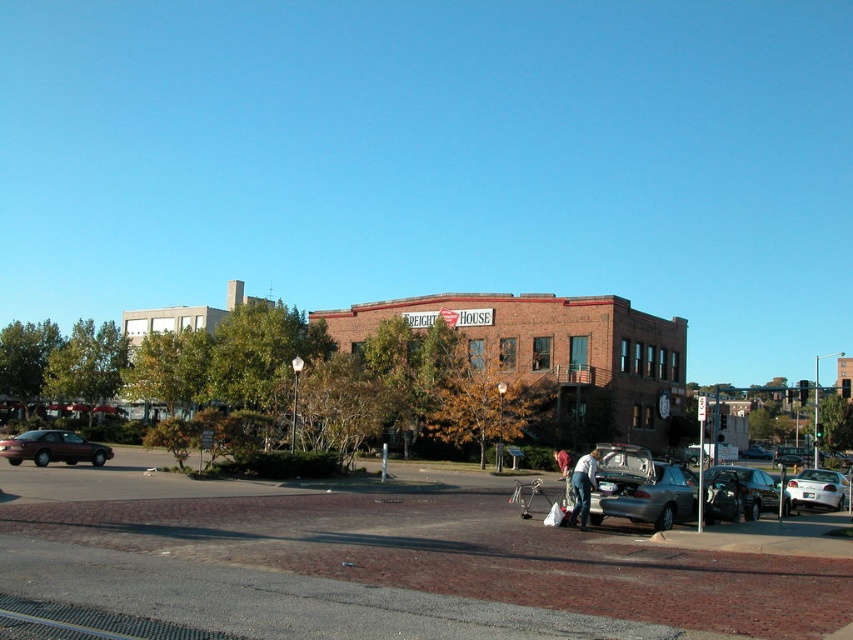
You are a delivery person needing to park your van between the shiny maroon sedan at left and the shiny silver suv at lower right. Your van is 5 meters long. Can you fit your van in the space between them?

The distance between the shiny maroon sedan at left and the shiny silver suv at lower right is 22.36 meters. Since your van is only 5 meters long, there is sufficient space to park it between them.